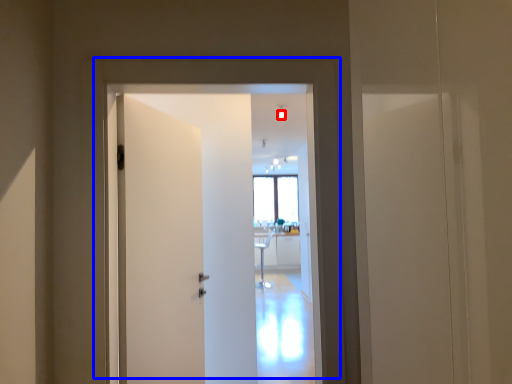
Question: Which point is further to the camera, light (highlighted by a red box) or door (highlighted by a blue box)?

Choices:
 (A) light
 (B) door

Answer: (A)